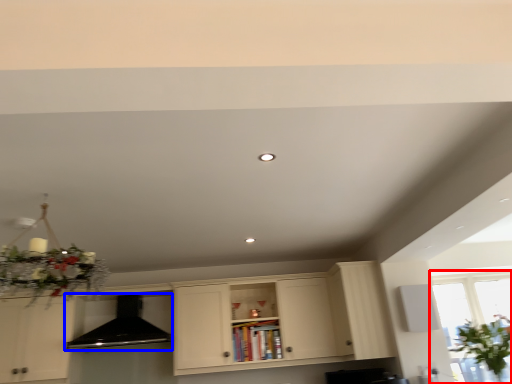
Question: Which point is closer to the camera, window (highlighted by a red box) or exhaust hood (highlighted by a blue box)?

Choices:
 (A) window
 (B) exhaust hood

Answer: (A)